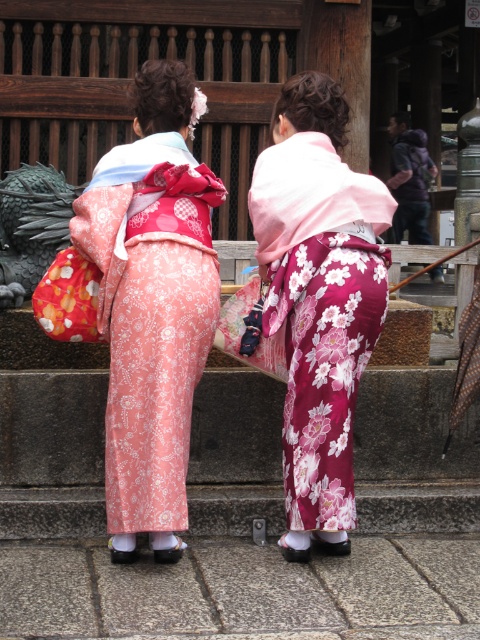
Question: Does pink satin kimono at center appear on the left side of floral silk kimono at center?

Choices:
 (A) yes
 (B) no

Answer: (A)

Question: Which of the following is the closest to the observer?

Choices:
 (A) floral silk kimono at center
 (B) pink satin kimono at center

Answer: (B)

Question: Considering the relative positions of pink satin kimono at center and floral silk kimono at center in the image provided, where is pink satin kimono at center located with respect to floral silk kimono at center?

Choices:
 (A) right
 (B) left

Answer: (B)

Question: Is pink satin kimono at center below floral silk kimono at center?

Choices:
 (A) yes
 (B) no

Answer: (B)